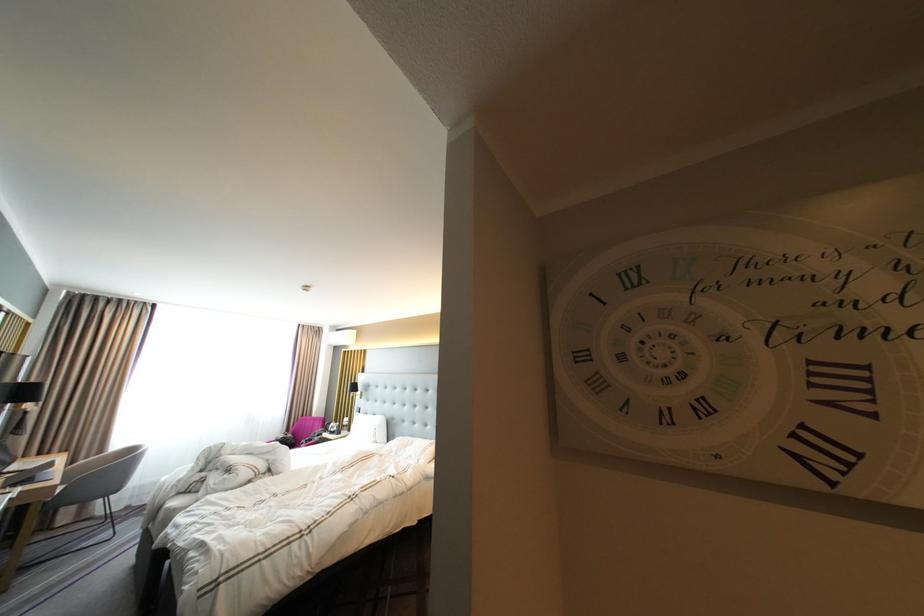
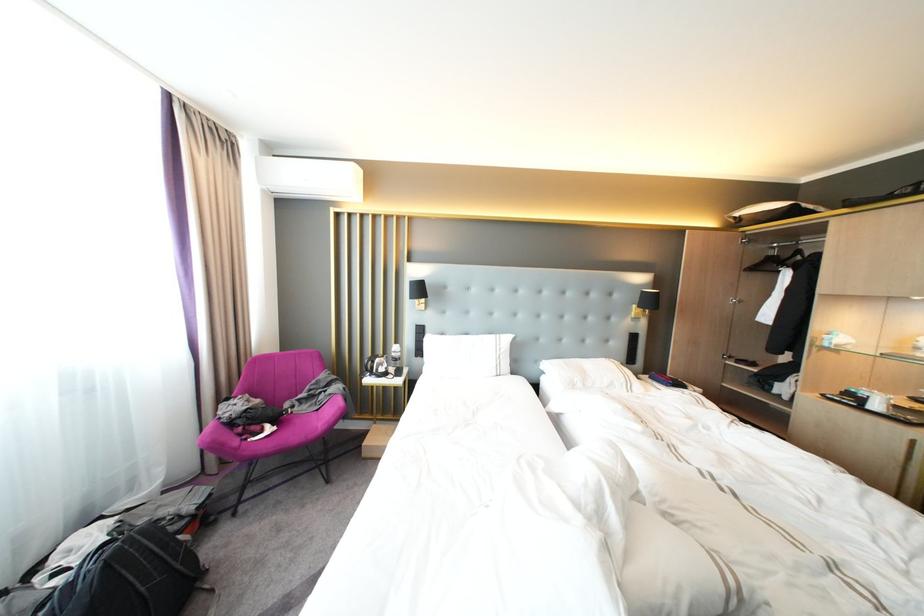
Locate, in the second image, the point that corresponds to (x=342, y=426) in the first image.

(384, 363)